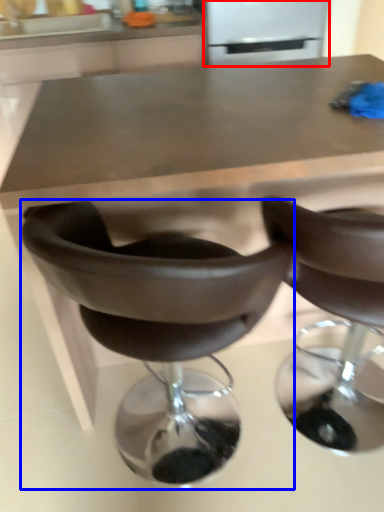
Question: Among these objects, which one is nearest to the camera, appliance (highlighted by a red box) or chair (highlighted by a blue box)?

Choices:
 (A) appliance
 (B) chair

Answer: (B)